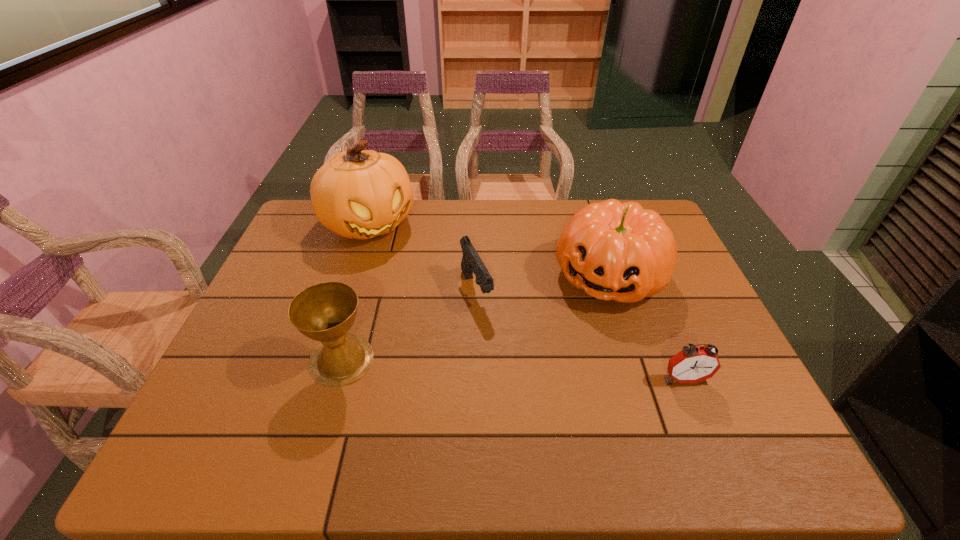
Identify the location of pumpkin that is at the right edge. The height and width of the screenshot is (540, 960). (617, 251).

The image size is (960, 540). I want to click on object that is at the far left corner, so (356, 194).

You are a GUI agent. You are given a task and a screenshot of the screen. Output one action in this format:
    pyautogui.click(x=<x>, y=<y>)
    Task: Click on the object that is at the far right corner
    
    Given the screenshot: What is the action you would take?
    pyautogui.click(x=617, y=251)

This screenshot has width=960, height=540. Find the location of `object positioned at the near right corner`. object positioned at the near right corner is located at coordinates (693, 364).

This screenshot has height=540, width=960. Identify the location of free spot at the far edge of the desktop. (411, 231).

Image resolution: width=960 pixels, height=540 pixels. What are the coordinates of `free space at the near edge of the desktop` in the screenshot? It's located at [x=287, y=411].

Identify the location of vacant space at the left edge. The image size is (960, 540). (297, 265).

The width and height of the screenshot is (960, 540). I want to click on vacant space at the far left corner of the desktop, so click(x=314, y=220).

Locate an element on the screen. This screenshot has width=960, height=540. vacant space at the near left corner of the desktop is located at coordinates (254, 405).

The image size is (960, 540). In order to click on vacant space that's between the pistol and the alarm clock in this screenshot , I will do `click(581, 335)`.